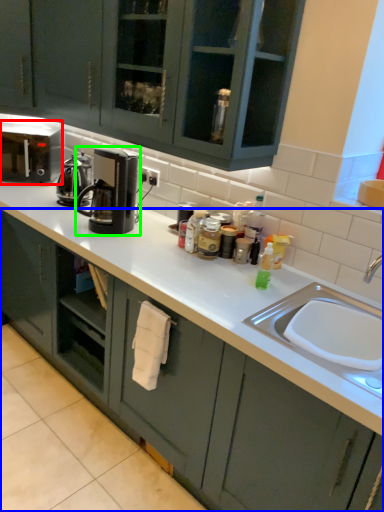
Question: Based on their relative distances, which object is farther from home appliance (highlighted by a red box)? Choose from cabinetry (highlighted by a blue box) and kitchen appliance (highlighted by a green box).

Choices:
 (A) cabinetry
 (B) kitchen appliance

Answer: (A)